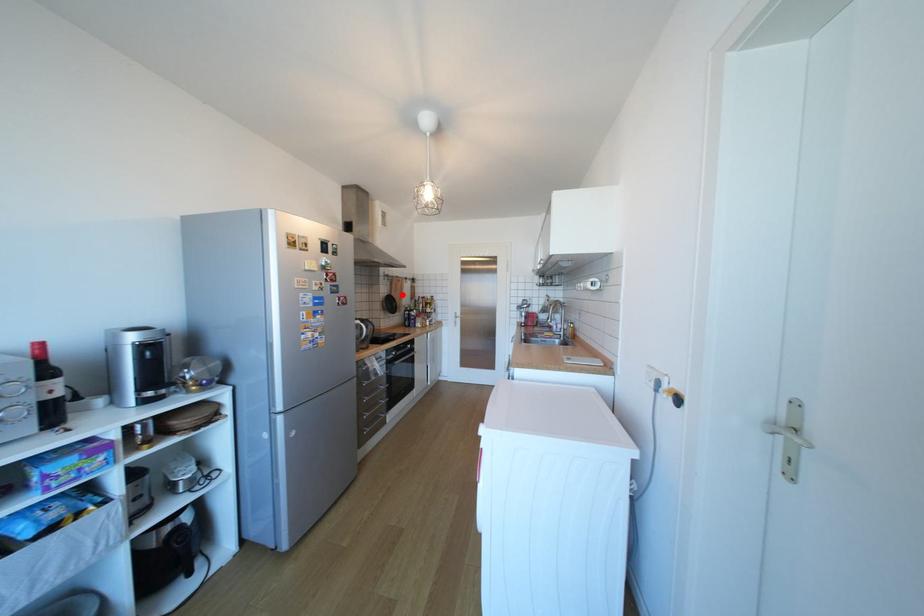
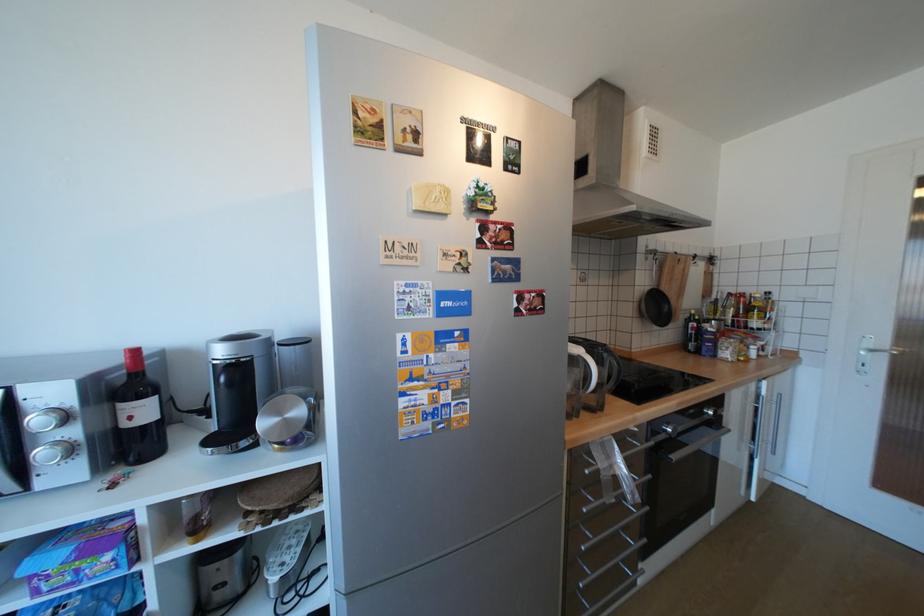
The point at the highlighted location is marked in the first image. Where is the corresponding point in the second image?

(672, 290)